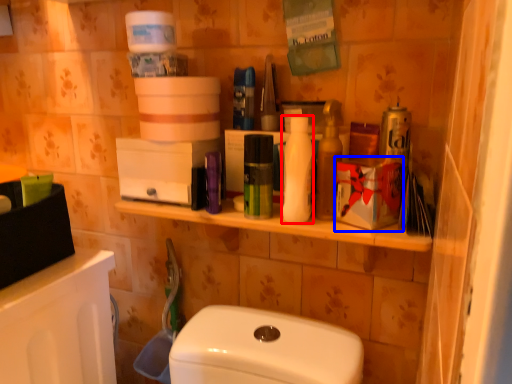
Question: Which object is further to the camera taking this photo, toiletry (highlighted by a red box) or box (highlighted by a blue box)?

Choices:
 (A) toiletry
 (B) box

Answer: (A)